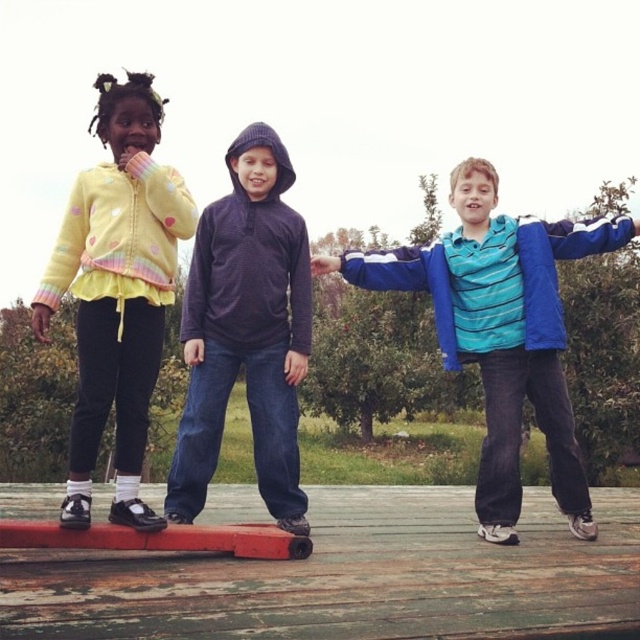
Is point (493, 419) positioned after point (243, 307)?

Yes, point (493, 419) is behind point (243, 307).

From the picture: Is blue striped shirt at center further to the viewer compared to purple fleece hoodie at center?

Yes, it is.

Describe the element at coordinates (500, 330) in the screenshot. The image size is (640, 640). I see `blue striped shirt at center` at that location.

Where is `blue striped shirt at center`? blue striped shirt at center is located at coordinates (500, 330).

Which is below, wooden plank at center or yellow fleece jacket at left?

wooden plank at center is lower down.

What do you see at coordinates (346, 577) in the screenshot? This screenshot has width=640, height=640. I see `wooden plank at center` at bounding box center [346, 577].

You are a GUI agent. You are given a task and a screenshot of the screen. Output one action in this format:
    pyautogui.click(x=<x>, y=<y>)
    Task: Click on the wooden plank at center
    
    Given the screenshot: What is the action you would take?
    pyautogui.click(x=346, y=577)

The image size is (640, 640). In order to click on wooden plank at center in this screenshot , I will do `click(346, 577)`.

Does point (40, 557) come in front of point (269, 442)?

Yes, it is.

Is wooden plank at center above purple fleece hoodie at center?

No.

Identify the location of wooden plank at center. Image resolution: width=640 pixels, height=640 pixels. (346, 577).